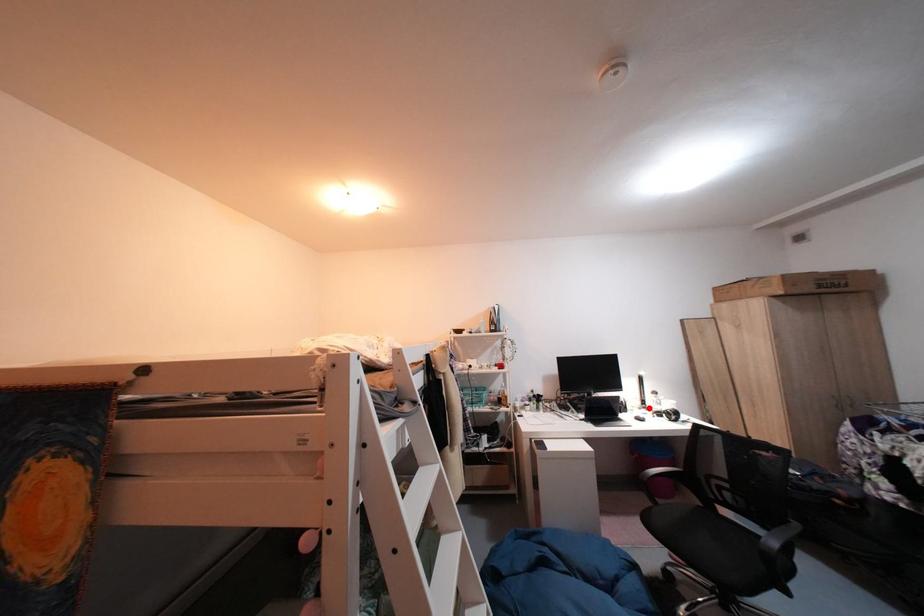
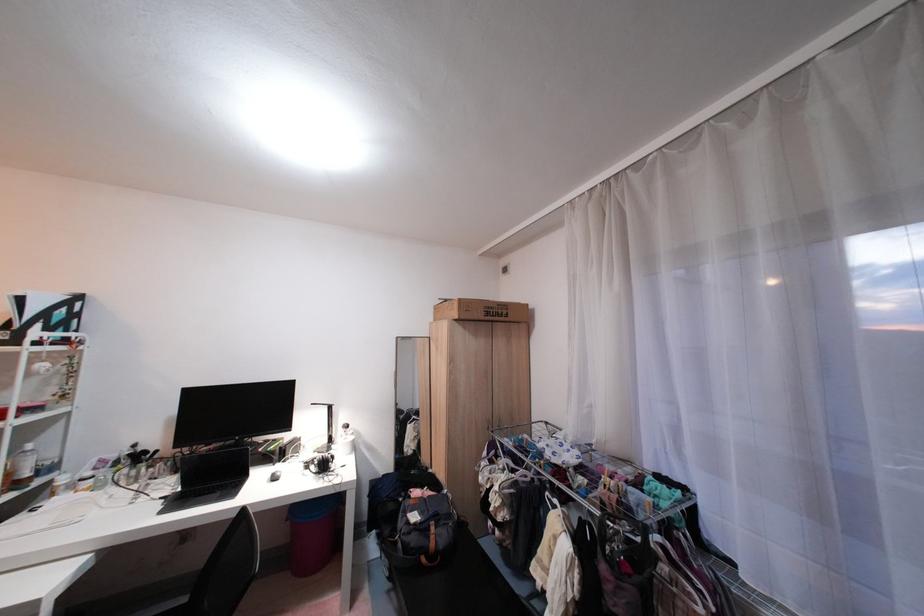
Locate, in the second image, the point that corresponds to the highlighted location in the first image.

(326, 450)